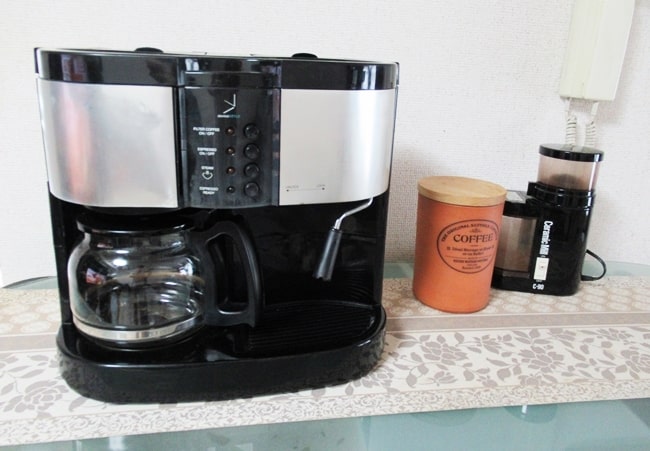
Locate an element on the screen. This screenshot has width=650, height=451. wall is located at coordinates (439, 74).